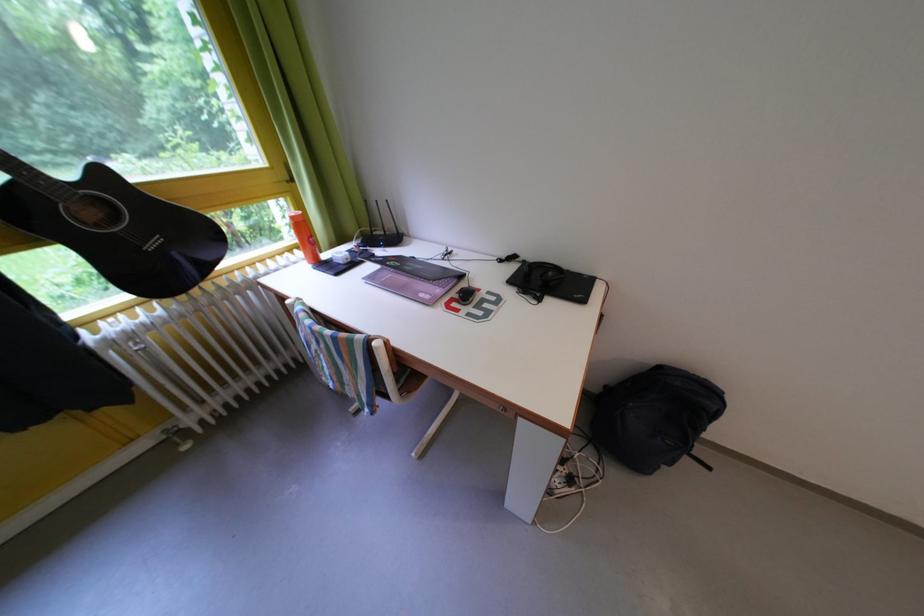
This screenshot has height=616, width=924. What do you see at coordinates (137, 345) in the screenshot?
I see `a radiator valve knob` at bounding box center [137, 345].